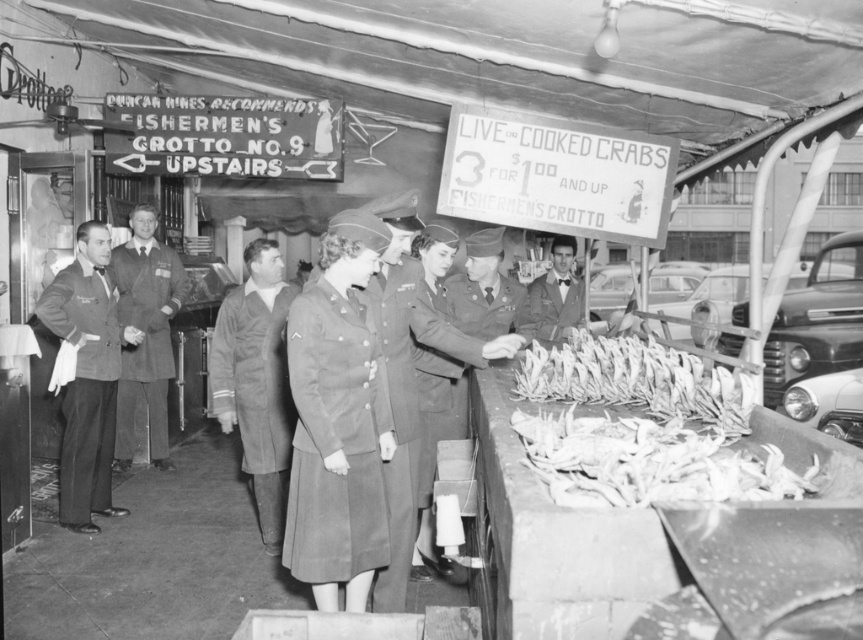
You are a customer at the market and want to buy the white crabs at center and the smooth gray suit at center. Which item is closer to the left side of the market scene?

The white crabs at center are to the left of the smooth gray suit at center, so they are closer to the left side of the market scene.

You are a vendor at the market and need to place a large crate that is 1.2 meters wide between the white crabs at center and the gray wool uniform at center. Can you fit the crate between them?

The white crabs at center are wider than the gray wool uniform at center. However, the exact distance between them isn